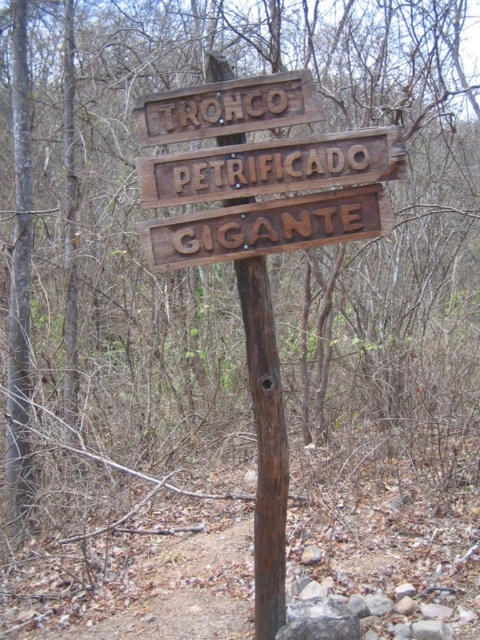
Which of these two, brown carved wood sign at center or brown wooden sign at upper center, stands shorter?

brown wooden sign at upper center is shorter.

Who is more forward, (x=211, y=212) or (x=319, y=116)?

Point (x=319, y=116) is in front.

Which is behind, point (286, 234) or point (278, 83)?

Positioned behind is point (286, 234).

Find the location of a particular element. brown carved wood sign at center is located at coordinates (266, 227).

Between brown wooden sign at center and brown carved wood sign at center, which one is positioned lower?

brown carved wood sign at center

This screenshot has height=640, width=480. Identify the location of brown wooden sign at center. (272, 166).

At what (x,y) coordinates should I click in order to perform the action: click on brown wooden sign at center. Please return your answer as a coordinate pair (x, y). Looking at the image, I should click on (272, 166).

The height and width of the screenshot is (640, 480). Describe the element at coordinates (272, 166) in the screenshot. I see `brown wooden sign at center` at that location.

You are a GUI agent. You are given a task and a screenshot of the screen. Output one action in this format:
    pyautogui.click(x=<x>, y=<y>)
    Task: Click on the brown wooden sign at center
    The width and height of the screenshot is (480, 640).
    Given the screenshot: What is the action you would take?
    pyautogui.click(x=272, y=166)